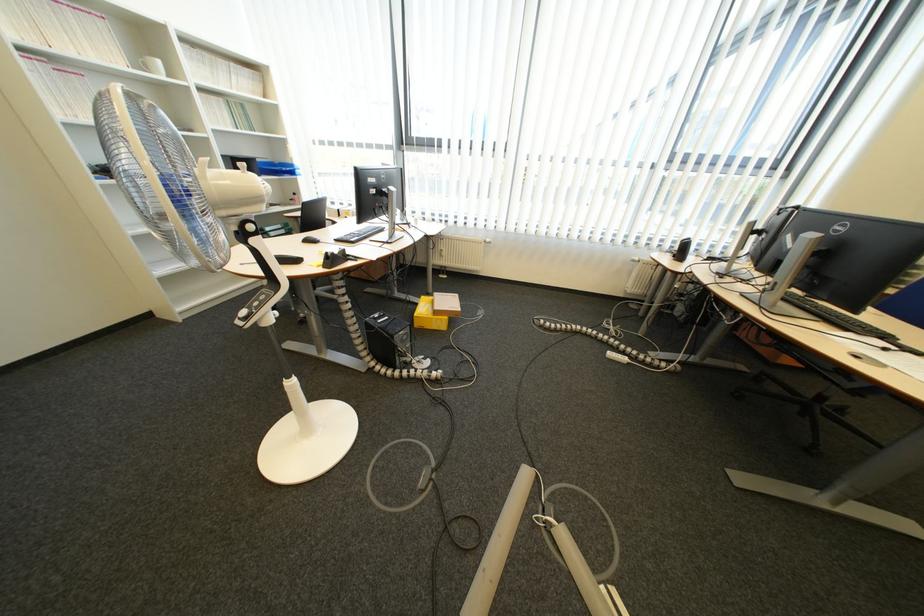
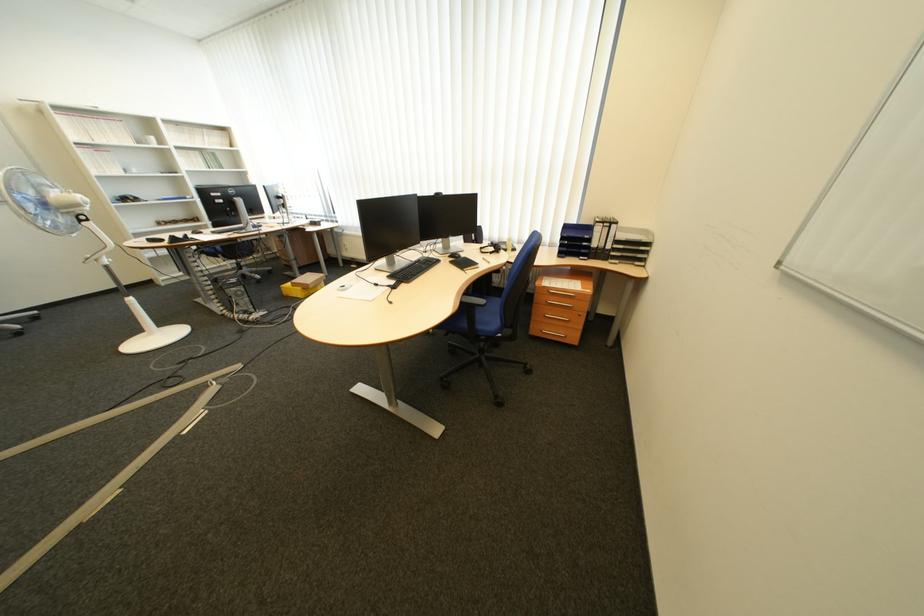
In the second image, find the point that corresponds to [459,318] in the first image.

(313, 290)